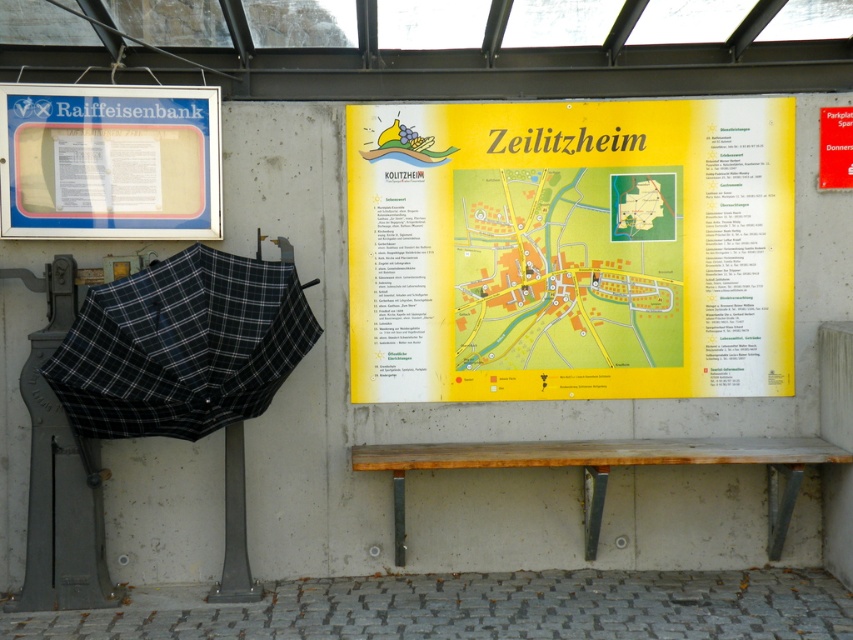
Is point (74, 326) positioned in front of point (480, 460)?

Yes, point (74, 326) is closer to viewer.

Between point (256, 349) and point (660, 449), which one is positioned behind?

Positioned behind is point (660, 449).

I want to click on black checkered umbrella at left, so click(x=181, y=346).

Is yellow paper map at center smaller than black checkered umbrella at left?

Yes.

Is yellow paper map at center further to the viewer compared to black checkered umbrella at left?

Yes, it is.

Is point (531, 179) positioned behind point (180, 371)?

Yes, it is behind point (180, 371).

At what (x,y) coordinates should I click in order to perform the action: click on yellow paper map at center. Please return your answer as a coordinate pair (x, y). This screenshot has width=853, height=640. Looking at the image, I should click on (567, 268).

Does yellow paper map at center have a greater height compared to matte plastic sign at upper left?

Indeed, yellow paper map at center has a greater height compared to matte plastic sign at upper left.

Measure the distance from yellow paper map at center to matte plastic sign at upper left.

5.24 feet

Is point (601, 221) in front of point (167, 113)?

That is False.

Image resolution: width=853 pixels, height=640 pixels. I want to click on yellow paper map at center, so click(x=567, y=268).